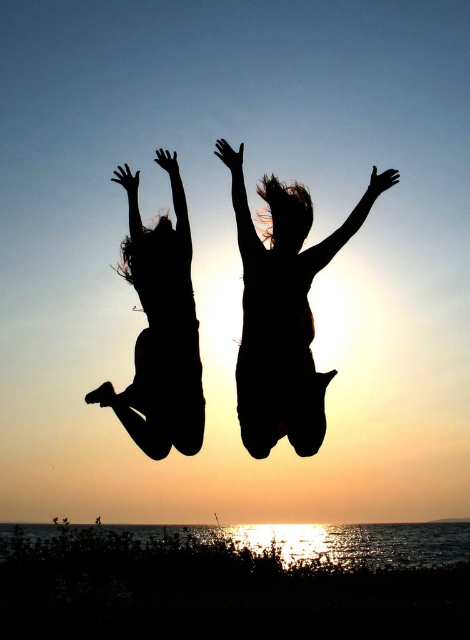
Question: Does black matte silhouette at center lie in front of black silhouette girl at left?

Choices:
 (A) yes
 (B) no

Answer: (A)

Question: Is black matte silhouette at center smaller than black silhouette girl at left?

Choices:
 (A) yes
 (B) no

Answer: (B)

Question: Does black matte silhouette at center have a greater width compared to black silhouette girl at left?

Choices:
 (A) yes
 (B) no

Answer: (A)

Question: Which point is closer to the camera?

Choices:
 (A) black silhouette girl at left
 (B) black matte silhouette at center

Answer: (B)

Question: Which object is closer to the camera taking this photo?

Choices:
 (A) black silhouette girl at left
 (B) black matte silhouette at center

Answer: (B)

Question: Which object appears farthest from the camera in this image?

Choices:
 (A) black matte silhouette at center
 (B) black silhouette girl at left

Answer: (B)